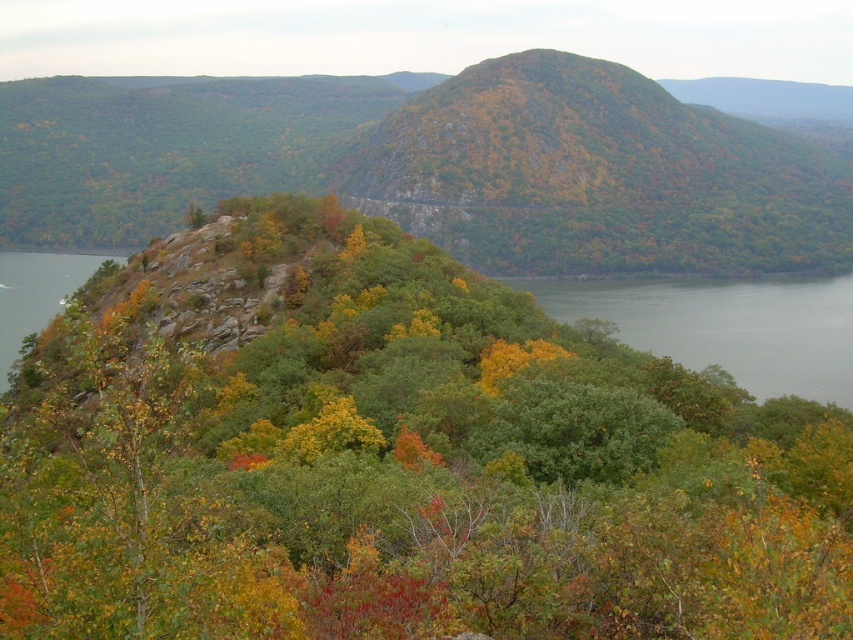
Question: Is green leafy tree at center positioned before green liquid water at left?

Choices:
 (A) yes
 (B) no

Answer: (A)

Question: Which of the following is the closest to the observer?

Choices:
 (A) green rocky mountain at center
 (B) green liquid water at left
 (C) gray water at lower right
 (D) green leafy tree at center

Answer: (D)

Question: Considering the relative positions of green leafy tree at center and green liquid water at left in the image provided, where is green leafy tree at center located with respect to green liquid water at left?

Choices:
 (A) left
 (B) right

Answer: (B)

Question: Is green rocky mountain at center in front of green liquid water at left?

Choices:
 (A) no
 (B) yes

Answer: (A)

Question: Based on their relative distances, which object is farther from the gray water at lower right?

Choices:
 (A) green liquid water at left
 (B) green rocky mountain at center

Answer: (A)

Question: Which of these objects is positioned closest to the gray water at lower right?

Choices:
 (A) green rocky mountain at center
 (B) green leafy tree at center

Answer: (B)